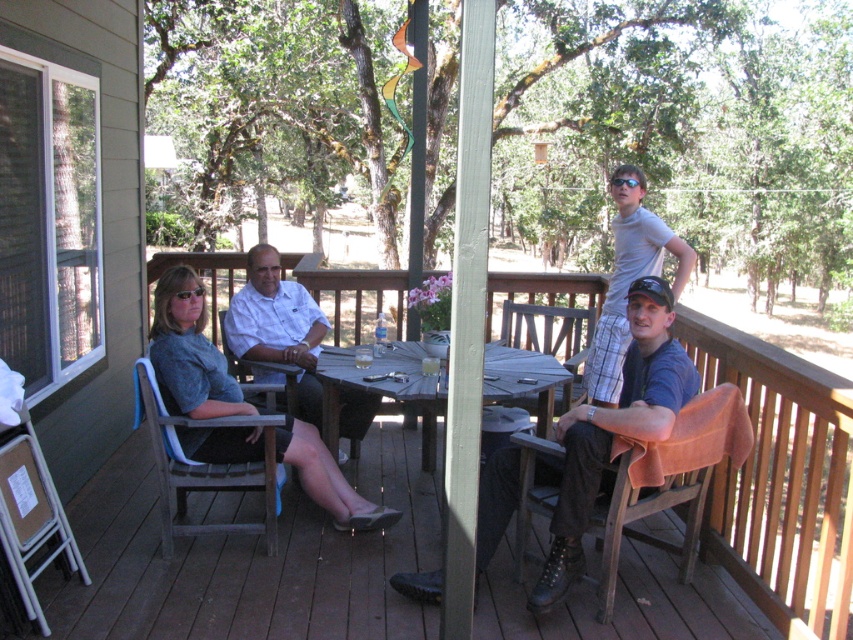
Can you confirm if wooden chair at lower left is smaller than wooden chair at center?

Yes, wooden chair at lower left is smaller than wooden chair at center.

Who is positioned more to the left, wooden chair at lower left or wooden chair at center?

wooden chair at lower left

Locate an element on the screen. wooden chair at lower left is located at coordinates (199, 468).

Which is behind, point (654, 426) or point (183, 522)?

The point (183, 522) is behind.

Consider the image. Does dark blue shirt at center have a greater width compared to wooden chair at lower left?

Yes.

Identify the location of dark blue shirt at center. This screenshot has width=853, height=640. (611, 433).

Find the location of a particular element. dark blue shirt at center is located at coordinates coord(611,433).

Can you confirm if wooden chair at lower left is thinner than light gray plaid shorts at upper right?

In fact, wooden chair at lower left might be wider than light gray plaid shorts at upper right.

How much distance is there between wooden chair at lower left and light gray plaid shorts at upper right?

wooden chair at lower left is 2.20 meters away from light gray plaid shorts at upper right.

Identify the location of wooden chair at lower left. (199, 468).